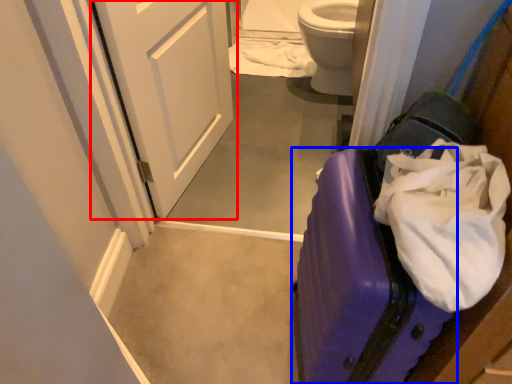
Question: Which object appears closest to the camera in this image, door (highlighted by a red box) or suitcase (highlighted by a blue box)?

Choices:
 (A) door
 (B) suitcase

Answer: (B)